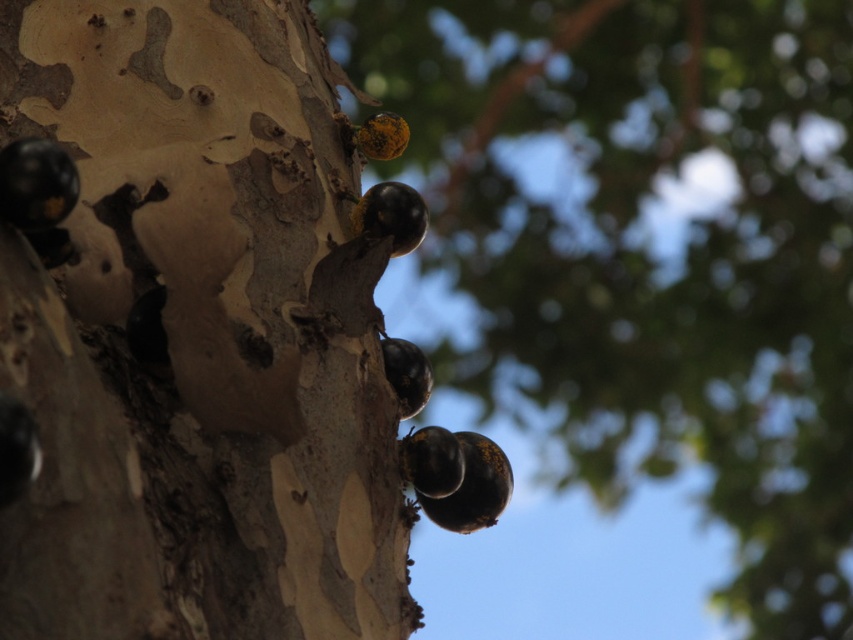
Can you confirm if matte bark tree trunk at upper left is positioned above shiny black berries at upper center?

Actually, matte bark tree trunk at upper left is below shiny black berries at upper center.

Who is positioned more to the left, matte bark tree trunk at upper left or shiny black berries at upper center?

matte bark tree trunk at upper left

Is point (251, 540) behind point (762, 460)?

No, (251, 540) is closer to viewer.

Where is `matte bark tree trunk at upper left`? This screenshot has height=640, width=853. matte bark tree trunk at upper left is located at coordinates (196, 337).